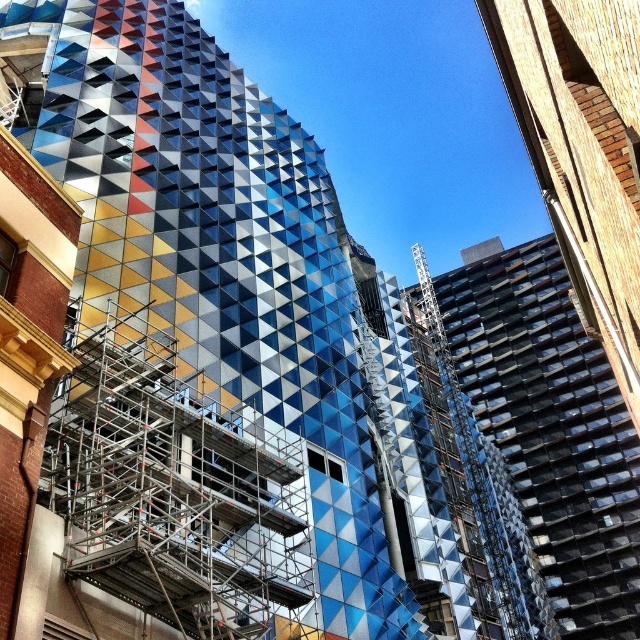
You are an architect reviewing the construction site of the building. You notice the metallic geometric facade at center and the silver metallic scaffolding at center. Which one appears closer to you from your current viewpoint?

The metallic geometric facade at center appears closer to you because it is positioned further to the viewer than the silver metallic scaffolding at center.

You are an architect examining the construction site of the building. You notice a specific point at coordinates point (244,284). Based on the scene, where is this point located?

The point (244,284) is on the metallic geometric facade at center.

You are a construction worker standing on the ground floor of the building. You need to move a heavy beam that is 10 meters long from the metallic geometric facade at center to the silver metallic scaffolding at center. Can you safely move the beam horizontally without bending it?

The distance between the metallic geometric facade at center and the silver metallic scaffolding at center is 11.47 meters. Since the beam is only 10 meters long, it can be moved horizontally without bending as it is shorter than the available space between them.